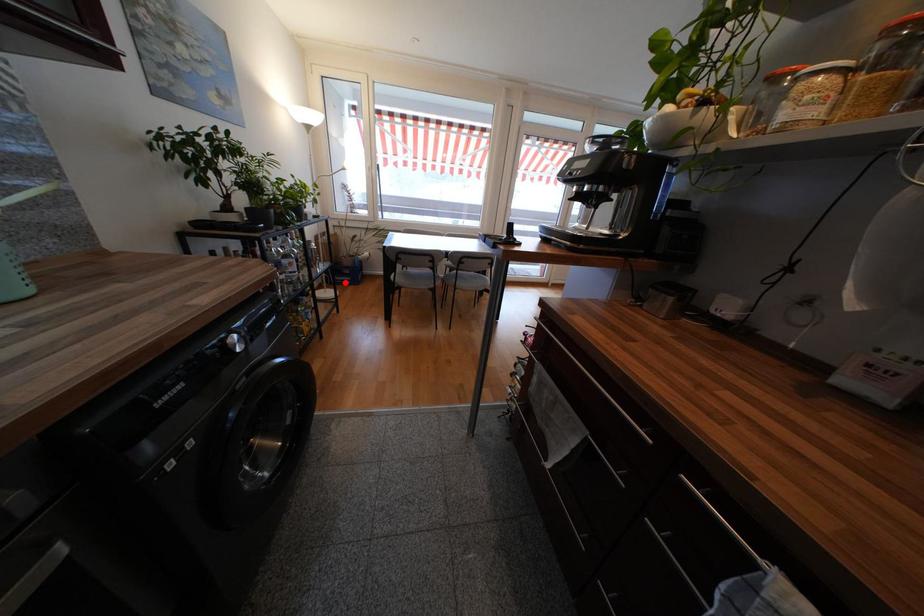
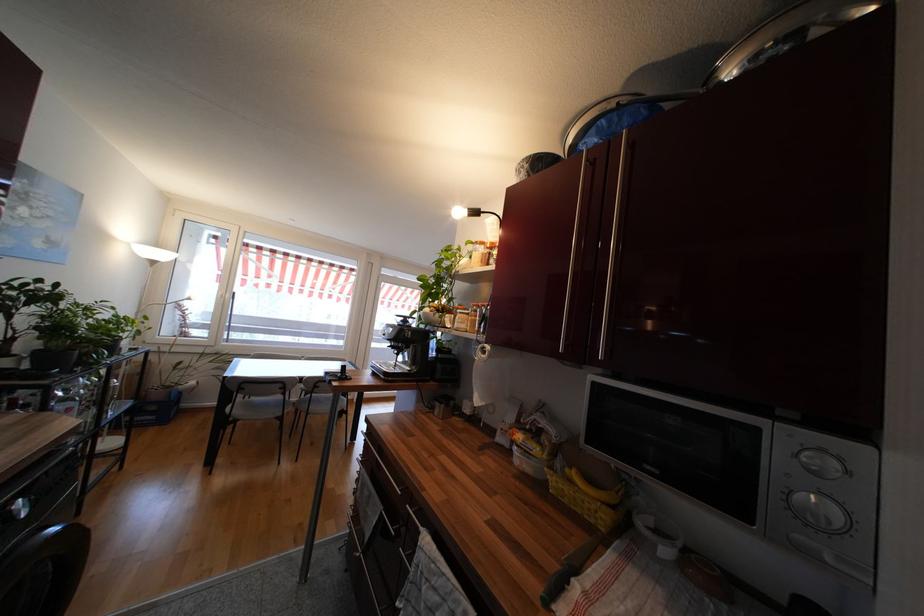
Question: I am providing you with two images of the same scene from different viewpoints. Image1 has a red point marked. In image2, the corresponding 3D location appears at what relative position? Reply with the corresponding letter.

Choices:
 (A) Closer
 (B) Farther

Answer: (B)